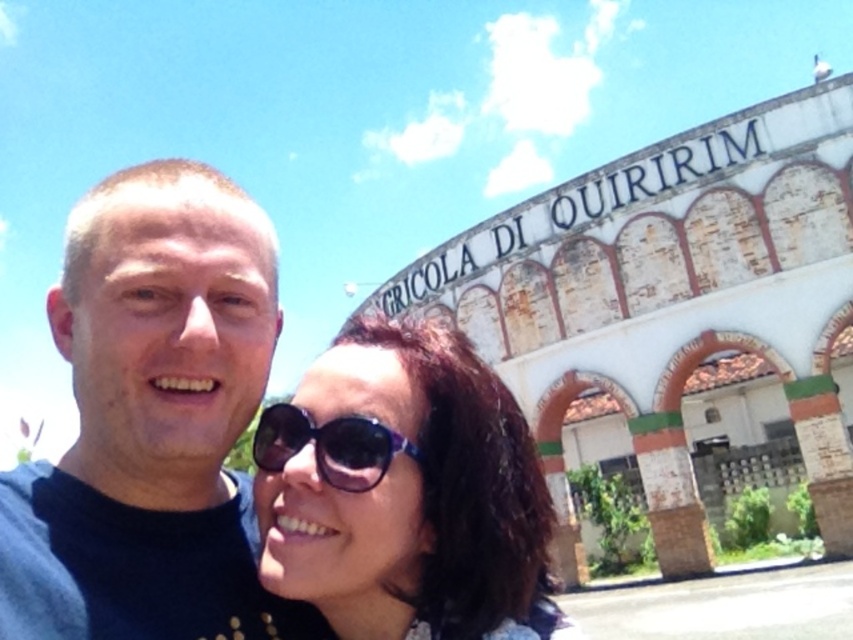
In the scene shown: Is black matte shirt at center shorter than transparent plastic sunglasses at center?

Incorrect, black matte shirt at center's height does not fall short of transparent plastic sunglasses at center's.

Does point (120, 353) lie in front of point (281, 454)?

Yes.

Between point (161, 536) and point (274, 432), which one is positioned in front?

Point (161, 536) is in front.

Locate an element on the screen. The height and width of the screenshot is (640, 853). black matte shirt at center is located at coordinates (151, 420).

Who is lower down, black matte shirt at center or sunglasses at center?

Positioned lower is black matte shirt at center.

This screenshot has width=853, height=640. Describe the element at coordinates (151, 420) in the screenshot. I see `black matte shirt at center` at that location.

Is point (175, 204) farther from viewer compared to point (489, 596)?

Yes, point (175, 204) is farther from viewer.

You are a GUI agent. You are given a task and a screenshot of the screen. Output one action in this format:
    pyautogui.click(x=<x>, y=<y>)
    Task: Click on the black matte shirt at center
    This screenshot has height=640, width=853.
    Given the screenshot: What is the action you would take?
    pyautogui.click(x=151, y=420)

Which is behind, point (380, 508) or point (329, 435)?

The point (329, 435) is behind.

Is sunglasses at center closer to camera compared to transparent plastic sunglasses at center?

Yes, sunglasses at center is in front of transparent plastic sunglasses at center.

Does point (276, 480) come behind point (334, 438)?

Yes, point (276, 480) is behind point (334, 438).

Identify the location of sunglasses at center. Image resolution: width=853 pixels, height=640 pixels. (405, 492).